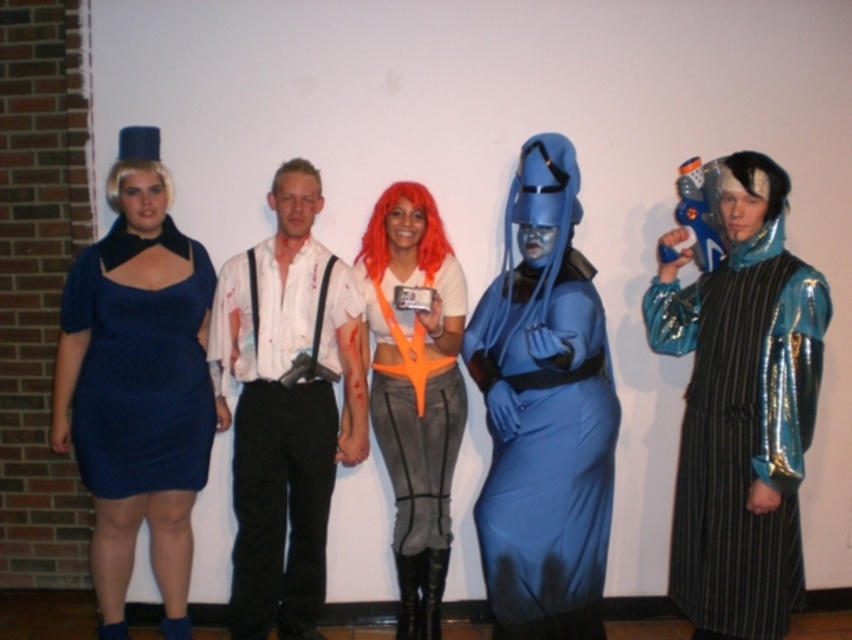
Question: Is metallic blue robe at center bigger than orange fabric top at center?

Choices:
 (A) no
 (B) yes

Answer: (A)

Question: Which object is the farthest from the metallic blue robe at center?

Choices:
 (A) navy blue fabric dress at left
 (B) matte blue costume at center
 (C) white matte shirt at center
 (D) orange fabric top at center

Answer: (A)

Question: Which of these objects is positioned farthest from the matte blue dress at left?

Choices:
 (A) metallic blue robe at center
 (B) white matte shirt at center
 (C) orange fabric top at center
 (D) navy blue fabric dress at left

Answer: (A)

Question: Considering the relative positions of matte blue dress at left and navy blue fabric dress at left in the image provided, where is matte blue dress at left located with respect to navy blue fabric dress at left?

Choices:
 (A) below
 (B) above

Answer: (A)

Question: Which point is farther to the camera?

Choices:
 (A) (137, 406)
 (B) (297, 547)
 (C) (505, 221)

Answer: (B)

Question: Does metallic blue robe at center lie in front of white matte shirt at center?

Choices:
 (A) no
 (B) yes

Answer: (B)